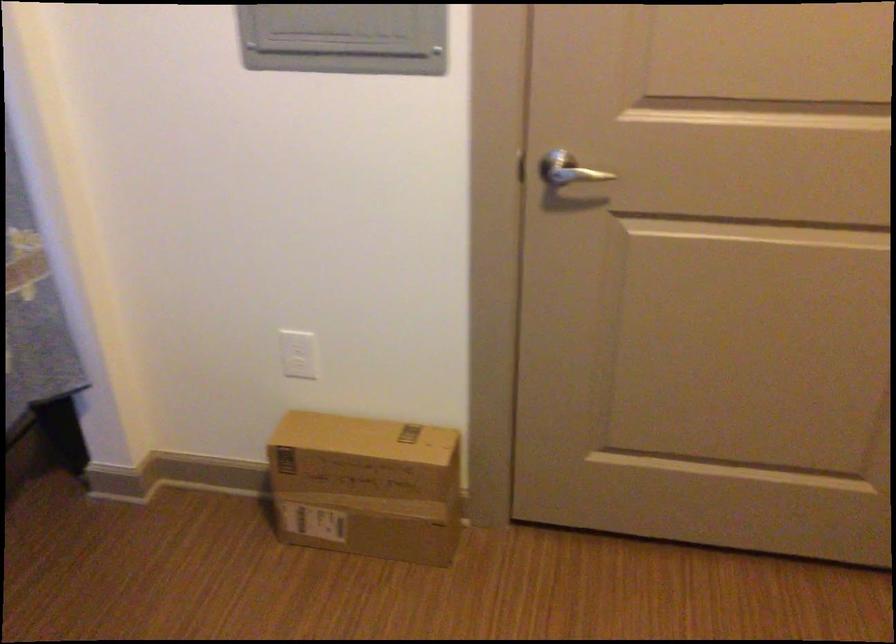
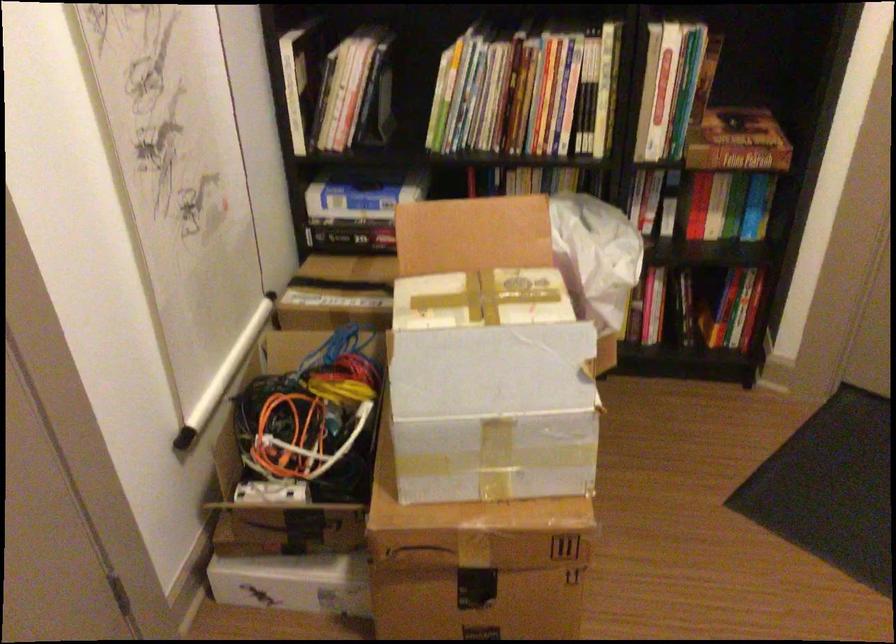
How did the camera likely rotate?

The camera's rotation is toward right-down.